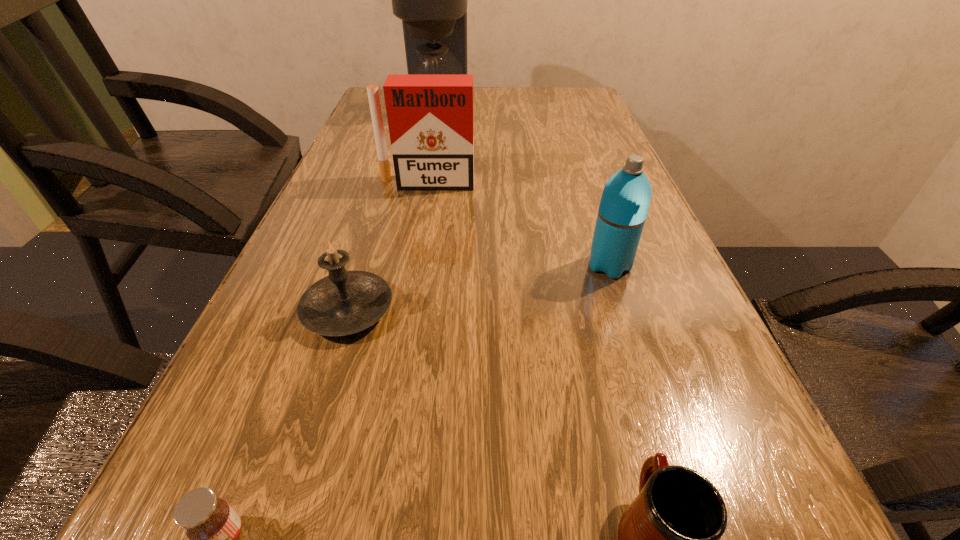
Image resolution: width=960 pixels, height=540 pixels. In order to click on the tallest object in this screenshot , I will do `click(431, 0)`.

Locate an element on the screen. the farthest object is located at coordinates (431, 0).

Identify the location of cigarette case. [x=430, y=116].

Identify the location of thermos bottle. Image resolution: width=960 pixels, height=540 pixels. (626, 197).

Locate an element on the screen. candle is located at coordinates (345, 302).

Image resolution: width=960 pixels, height=540 pixels. What are the coordinates of `vacant space located 0.310m on the button side of the farthest object` in the screenshot? It's located at (568, 112).

Image resolution: width=960 pixels, height=540 pixels. I want to click on free space located 0.220m on the front-facing side of the fifth nearest object, so click(416, 248).

You are a GUI agent. You are given a task and a screenshot of the screen. Output one action in this format:
    pyautogui.click(x=<x>, y=<y>)
    Task: Click on the free space located on the back of the thermos bottle
    Image resolution: width=960 pixels, height=540 pixels.
    Given the screenshot: What is the action you would take?
    pyautogui.click(x=574, y=161)

Locate an element on the screen. The height and width of the screenshot is (540, 960). free space located on the front of the candle is located at coordinates (314, 420).

Find the location of a particular element. object at the far edge is located at coordinates (431, 0).